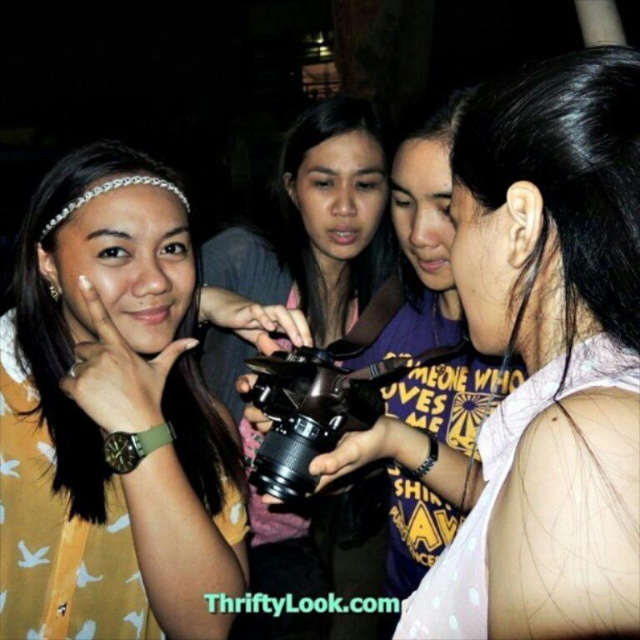
Does pink dotted tank top at center have a smaller size compared to black matte camera at center?

Correct, pink dotted tank top at center occupies less space than black matte camera at center.

Between point (554, 380) and point (209, 356), which one is positioned in front?

Positioned in front is point (554, 380).

The width and height of the screenshot is (640, 640). Identify the location of pink dotted tank top at center. point(548,356).

At what (x,y) coordinates should I click in order to perform the action: click on pink dotted tank top at center. Please return your answer as a coordinate pair (x, y). This screenshot has width=640, height=640. Looking at the image, I should click on pyautogui.click(x=548, y=356).

Does pink dotted tank top at center appear on the right side of yellow matte shirt at left?

Correct, you'll find pink dotted tank top at center to the right of yellow matte shirt at left.

Between point (477, 243) and point (60, 531), which one is positioned behind?

The point (60, 531) is behind.

Which is behind, point (595, 604) or point (172, 349)?

The point (172, 349) is more distant.

At what (x,y) coordinates should I click in order to perform the action: click on pink dotted tank top at center. Please return your answer as a coordinate pair (x, y). Looking at the image, I should click on (548, 356).

From the picture: Is yellow matte shirt at left positioned behind black matte camera at center?

No, yellow matte shirt at left is in front of black matte camera at center.

Is point (112, 212) in front of point (323, 337)?

Yes, it is in front of point (323, 337).

I want to click on yellow matte shirt at left, so click(113, 412).